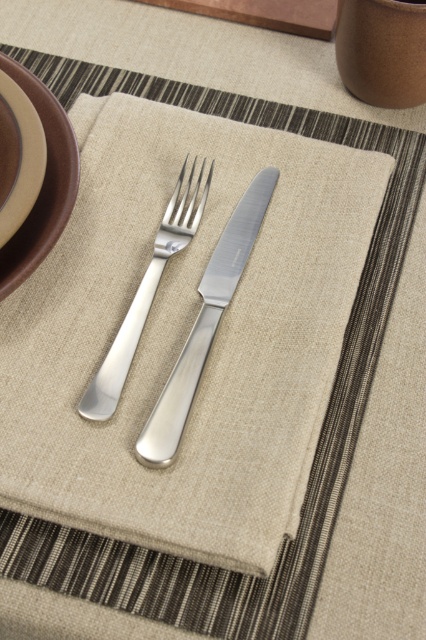
You are a server setting up a table and need to ensure that the utensils are spaced correctly according to health regulations, which require a minimum of 1 inch between the edges of any two utensils. Can you confirm if the spacing between the polished silver knife at center and the polished silver fork at center meets this requirement?

The distance between the polished silver knife at center and the polished silver fork at center is 1.18 inches, which exceeds the required 1 inch minimum, so it meets the health regulations.

You are setting up a dinner table and need to place a dessert plate between the brown ceramic platter at upper left and the polished silver fork at center. Based on their current positions, where should you place the dessert plate?

The dessert plate should be placed between the brown ceramic platter at upper left and the polished silver fork at center since the brown ceramic platter at upper left is positioned on the left side of the polished silver fork at center.

In the scene shown: You are setting up a formal dinner and need to place the utensils correctly. According to the image, is the polished silver knife at center positioned to the right or left of the polished silver fork at center?

The polished silver knife at center is to the right of the polished silver fork at center.